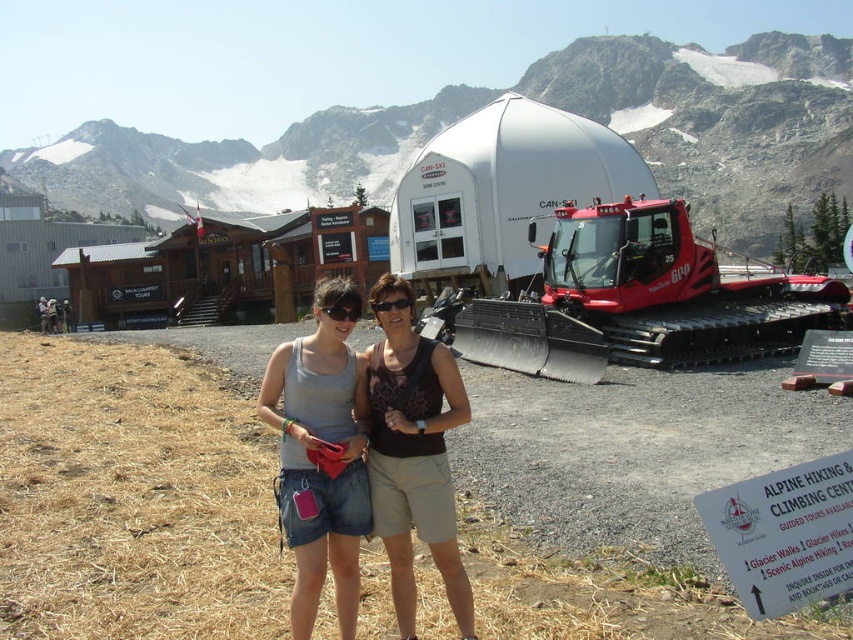
This screenshot has height=640, width=853. Find the location of `denim shorts at center`. denim shorts at center is located at coordinates (322, 456).

Is denim shorts at center shorter than black plastic goggles at center?

Incorrect, denim shorts at center's height does not fall short of black plastic goggles at center's.

You are a GUI agent. You are given a task and a screenshot of the screen. Output one action in this format:
    pyautogui.click(x=<x>, y=<y>)
    Task: Click on the denim shorts at center
    The image size is (853, 640).
    Given the screenshot: What is the action you would take?
    pyautogui.click(x=322, y=456)

I want to click on denim shorts at center, so click(322, 456).

Between point (344, 307) and point (402, 305), which one is positioned behind?

Positioned behind is point (402, 305).

Is point (338, 321) behind point (381, 300)?

No, it is in front of (381, 300).

Which is behind, point (347, 312) or point (387, 300)?

Point (387, 300)

Where is `black plastic goggles at center`? The image size is (853, 640). black plastic goggles at center is located at coordinates (341, 312).

Does point (309, 115) come farther from viewer compared to point (407, 305)?

Yes, point (309, 115) is behind point (407, 305).

Who is positioned more to the right, white matte dome at upper center or black matte goggles at center?

black matte goggles at center is more to the right.

Does point (764, 115) lie in front of point (407, 305)?

No.

Identify the location of white matte dome at upper center. This screenshot has height=640, width=853. (717, 116).